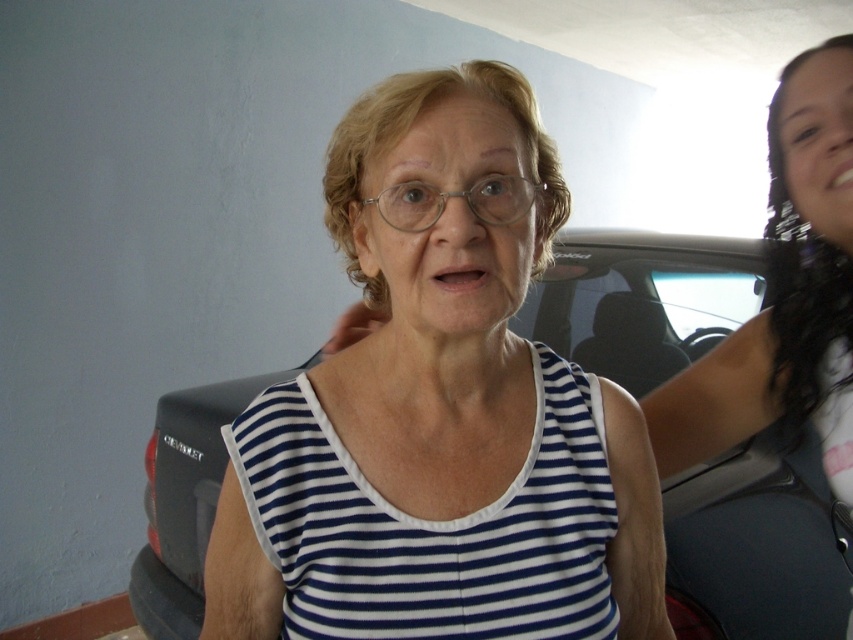
Can you confirm if metallic gray car at center is smaller than white striped tank top at center?

No, metallic gray car at center is not smaller than white striped tank top at center.

Does metallic gray car at center have a greater width compared to white striped tank top at center?

Correct, the width of metallic gray car at center exceeds that of white striped tank top at center.

Which is behind, point (630, 372) or point (851, 332)?

Positioned behind is point (630, 372).

Image resolution: width=853 pixels, height=640 pixels. I want to click on metallic gray car at center, so click(757, 545).

Does metallic gray car at center have a lesser width compared to blue and white striped tank top at center?

No, metallic gray car at center is not thinner than blue and white striped tank top at center.

This screenshot has width=853, height=640. What are the coordinates of `metallic gray car at center` in the screenshot? It's located at (757, 545).

Does blue and white striped tank top at center appear on the right side of white striped tank top at center?

Incorrect, blue and white striped tank top at center is not on the right side of white striped tank top at center.

Which is behind, point (502, 532) or point (793, 252)?

The point (793, 252) is behind.

Between point (543, 488) and point (836, 307), which one is positioned in front?

Point (543, 488) is more forward.

Where is `blue and white striped tank top at center`? blue and white striped tank top at center is located at coordinates (433, 528).